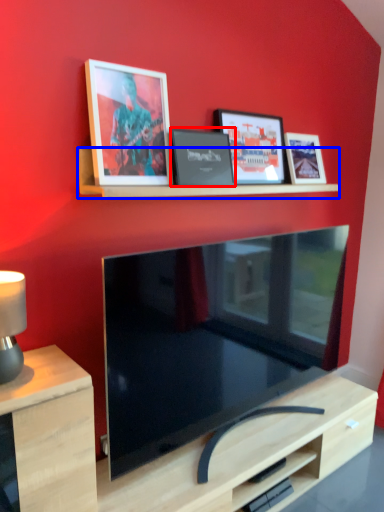
Question: Which point is closer to the camera, picture frame (highlighted by a red box) or shelf (highlighted by a blue box)?

Choices:
 (A) picture frame
 (B) shelf

Answer: (B)